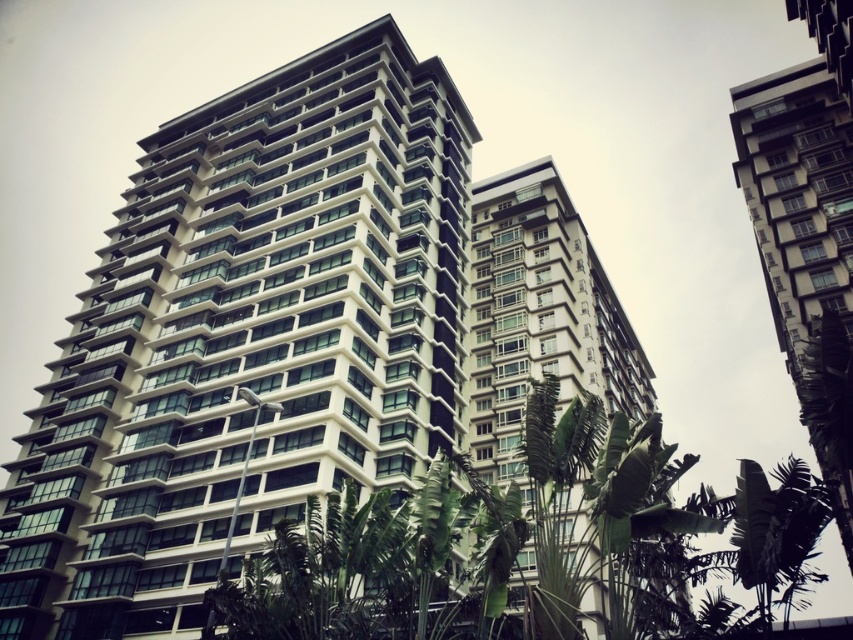
You are a drone operator trying to capture a photo of the white glossy building at center and the white glass building at center. From your current position, which building would appear closer in the photo?

The white glossy building at center would appear closer in the photo because it is positioned in front of the white glass building at center.

You are standing in the urban landscape scene and want to determine the relative positions of two points. Which point is closer to you, point (x=28, y=573) or point (x=514, y=212)?

Point (x=28, y=573) is closer to the viewer than point (x=514, y=212).

You are an urban planner analyzing the image. Based on the scene, which object takes up more space in the image? Please choose between the white glossy building at center and the green leafy tree at center.

The green leafy tree at center occupies more space in the image than the white glossy building at center according to the description.